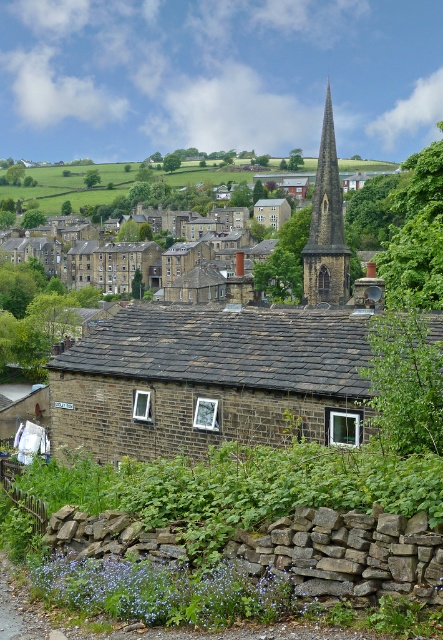
Question: Among these objects, which one is farthest from the camera?

Choices:
 (A) dark gray stone spire at center
 (B) brown stone church at center

Answer: (A)

Question: Is brown stone church at center smaller than dark gray stone spire at center?

Choices:
 (A) yes
 (B) no

Answer: (A)

Question: Is brown stone church at center smaller than dark gray stone spire at center?

Choices:
 (A) yes
 (B) no

Answer: (A)

Question: Which point is closer to the camera?

Choices:
 (A) tap(279, 387)
 (B) tap(326, 285)

Answer: (A)

Question: Among these objects, which one is nearest to the camera?

Choices:
 (A) dark gray stone spire at center
 (B) brown stone church at center

Answer: (B)

Question: Can you confirm if brown stone church at center is bigger than dark gray stone spire at center?

Choices:
 (A) yes
 (B) no

Answer: (B)